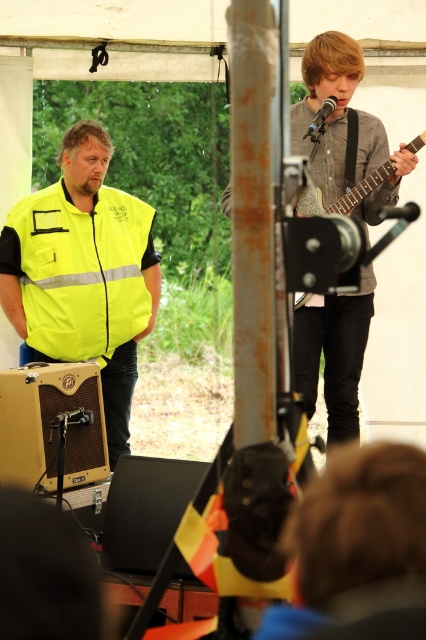
Is gray textured shirt at center taller than wooden acoustic guitar at upper right?

Correct, gray textured shirt at center is much taller as wooden acoustic guitar at upper right.

Between gray textured shirt at center and wooden acoustic guitar at upper right, which one is positioned higher?

gray textured shirt at center is higher up.

Image resolution: width=426 pixels, height=640 pixels. I want to click on gray textured shirt at center, so click(x=333, y=355).

Based on the photo, does yellow reflective vest at left have a lesser width compared to gray textured shirt at center?

Incorrect, yellow reflective vest at left's width is not less than gray textured shirt at center's.

Does yellow reflective vest at left appear on the right side of gray textured shirt at center?

No, yellow reflective vest at left is not to the right of gray textured shirt at center.

Between point (40, 292) and point (365, 113), which one is positioned in front?

Point (40, 292)

I want to click on yellow reflective vest at left, so click(x=83, y=273).

Measure the distance between yellow reflective vest at left and camera.

They are 4.92 meters apart.

Which is more to the left, yellow reflective vest at left or wooden acoustic guitar at upper right?

yellow reflective vest at left is more to the left.

You are a GUI agent. You are given a task and a screenshot of the screen. Output one action in this format:
    pyautogui.click(x=<x>, y=<y>)
    Task: Click on the yellow reflective vest at left
    The image size is (426, 640).
    Given the screenshot: What is the action you would take?
    click(x=83, y=273)